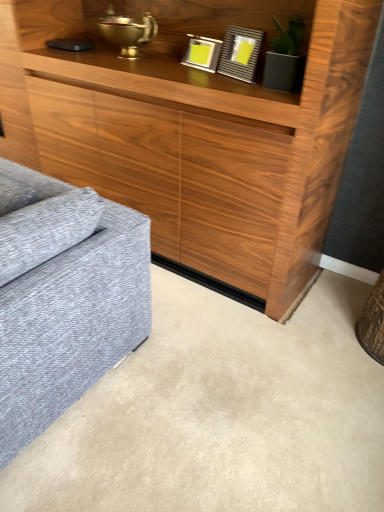
Question: In which direction should I rotate to look at metallic silver picture frame at upper center, the second picture frame in the right-to-left sequence?

Choices:
 (A) right
 (B) left

Answer: (A)

Question: Is metallic silver picture frame at upper center, the second picture frame in the right-to-left sequence, thinner than matte gray picture frame at upper center, the 1th picture frame viewed from the right?

Choices:
 (A) yes
 (B) no

Answer: (A)

Question: Is there a large distance between metallic silver picture frame at upper center, acting as the first picture frame starting from the left, and matte gray picture frame at upper center, the 2th picture frame positioned from the left?

Choices:
 (A) yes
 (B) no

Answer: (B)

Question: From the image's perspective, is metallic silver picture frame at upper center, the second picture frame in the right-to-left sequence, under matte gray picture frame at upper center, the 2th picture frame positioned from the left?

Choices:
 (A) yes
 (B) no

Answer: (B)

Question: Does metallic silver picture frame at upper center, the second picture frame in the right-to-left sequence, have a lesser height compared to matte gray picture frame at upper center, the 1th picture frame viewed from the right?

Choices:
 (A) yes
 (B) no

Answer: (A)

Question: Are metallic silver picture frame at upper center, acting as the first picture frame starting from the left, and matte gray picture frame at upper center, the 1th picture frame viewed from the right, making contact?

Choices:
 (A) yes
 (B) no

Answer: (B)

Question: Can you confirm if metallic silver picture frame at upper center, the second picture frame in the right-to-left sequence, is positioned to the right of matte gray picture frame at upper center, the 1th picture frame viewed from the right?

Choices:
 (A) yes
 (B) no

Answer: (B)

Question: Is matte gray picture frame at upper center, the 2th picture frame positioned from the left, bigger than metallic silver picture frame at upper center, the second picture frame in the right-to-left sequence?

Choices:
 (A) no
 (B) yes

Answer: (B)

Question: Is matte gray picture frame at upper center, the 1th picture frame viewed from the right, shorter than metallic silver picture frame at upper center, acting as the first picture frame starting from the left?

Choices:
 (A) yes
 (B) no

Answer: (B)

Question: Is the depth of matte gray picture frame at upper center, the 2th picture frame positioned from the left, greater than that of metallic silver picture frame at upper center, the second picture frame in the right-to-left sequence?

Choices:
 (A) no
 (B) yes

Answer: (A)

Question: Is metallic silver picture frame at upper center, acting as the first picture frame starting from the left, at the back of matte gray picture frame at upper center, the 1th picture frame viewed from the right?

Choices:
 (A) no
 (B) yes

Answer: (A)

Question: Is matte gray picture frame at upper center, the 2th picture frame positioned from the left, touching metallic silver picture frame at upper center, acting as the first picture frame starting from the left?

Choices:
 (A) yes
 (B) no

Answer: (B)

Question: Is matte gray picture frame at upper center, the 2th picture frame positioned from the left, to the left of metallic silver picture frame at upper center, acting as the first picture frame starting from the left, from the viewer's perspective?

Choices:
 (A) yes
 (B) no

Answer: (B)

Question: Is metallic silver picture frame at upper center, acting as the first picture frame starting from the left, wider or thinner than matte gray picture frame at upper center, the 2th picture frame positioned from the left?

Choices:
 (A) thin
 (B) wide

Answer: (A)